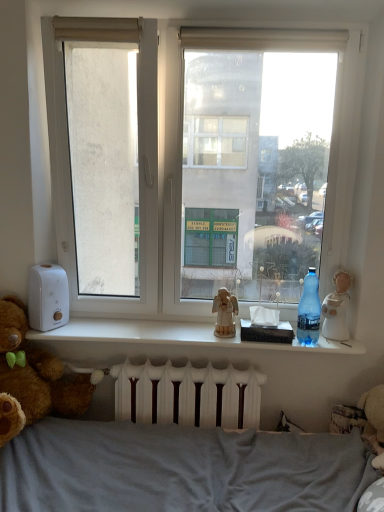
You are a GUI agent. You are given a task and a screenshot of the screen. Output one action in this format:
    pyautogui.click(x=<x>, y=<y>)
    Task: Click on the free space above transparent glass window at center (from a real-world perspective)
    Image resolution: width=384 pixels, height=512 pixels.
    Given the screenshot: What is the action you would take?
    pyautogui.click(x=206, y=9)